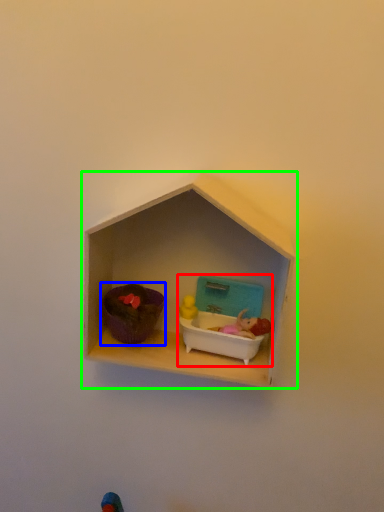
Question: Which object is the closest to the toy (highlighted by a red box)? Choose among these: toy (highlighted by a blue box) or shelf (highlighted by a green box).

Choices:
 (A) toy
 (B) shelf

Answer: (B)